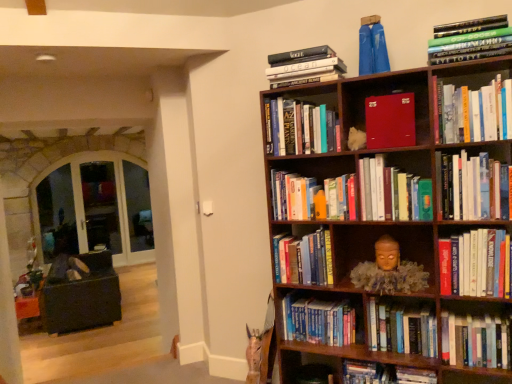
Question: Can you confirm if hardcover books at center right, positioned as the seventh book in top-to-bottom order, is thinner than matte red book at upper center, positioned as the 10th book in bottom-to-top order?

Choices:
 (A) yes
 (B) no

Answer: (B)

Question: Is hardcover books at center right, positioned as the seventh book in top-to-bottom order, taller than matte red book at upper center, positioned as the 10th book in bottom-to-top order?

Choices:
 (A) no
 (B) yes

Answer: (B)

Question: Is hardcover books at center right, positioned as the seventh book in top-to-bottom order, not inside matte red book at upper center, the fifth book when ordered from top to bottom?

Choices:
 (A) no
 (B) yes

Answer: (B)

Question: Is the position of hardcover books at center right, the eighth book when ordered from bottom to top, less distant than that of matte red book at upper center, positioned as the 10th book in bottom-to-top order?

Choices:
 (A) yes
 (B) no

Answer: (A)

Question: Is hardcover books at center right, positioned as the seventh book in top-to-bottom order, wider than matte red book at upper center, positioned as the 10th book in bottom-to-top order?

Choices:
 (A) no
 (B) yes

Answer: (B)

Question: Considering the relative sizes of hardcover books at center right, the eighth book when ordered from bottom to top, and matte red book at upper center, the fifth book when ordered from top to bottom, in the image provided, is hardcover books at center right, the eighth book when ordered from bottom to top, bigger than matte red book at upper center, the fifth book when ordered from top to bottom,?

Choices:
 (A) no
 (B) yes

Answer: (B)

Question: Can you confirm if matte gold statue at center is bigger than hardcover book at center, which ranks as the 5th book in bottom-to-top order?

Choices:
 (A) no
 (B) yes

Answer: (B)

Question: Does matte gold statue at center have a greater height compared to hardcover book at center, the 10th book from the top?

Choices:
 (A) yes
 (B) no

Answer: (B)

Question: Is matte gold statue at center oriented away from hardcover book at center, the 10th book from the top?

Choices:
 (A) no
 (B) yes

Answer: (A)

Question: Does matte gold statue at center come behind hardcover book at center, the 10th book from the top?

Choices:
 (A) yes
 (B) no

Answer: (B)

Question: From the image's perspective, does matte gold statue at center appear lower than hardcover book at center, the 10th book from the top?

Choices:
 (A) yes
 (B) no

Answer: (A)

Question: Is matte gold statue at center in front of hardcover book at center, the 10th book from the top?

Choices:
 (A) yes
 (B) no

Answer: (A)

Question: Would you say hardcover books at upper right, placed as the second book when sorted from top to bottom, contains hardcover book at upper right, the 4th book in the top-to-bottom sequence?

Choices:
 (A) yes
 (B) no

Answer: (B)